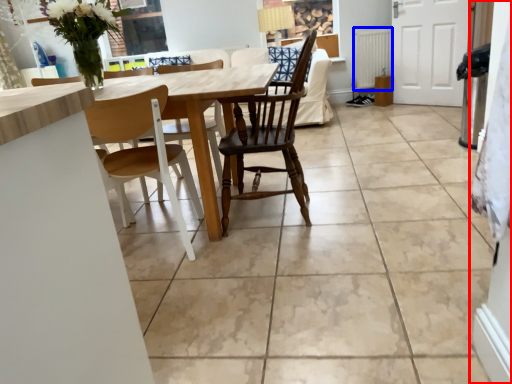
Question: Which point is further to the camera, side (highlighted by a red box) or radiator (highlighted by a blue box)?

Choices:
 (A) side
 (B) radiator

Answer: (B)